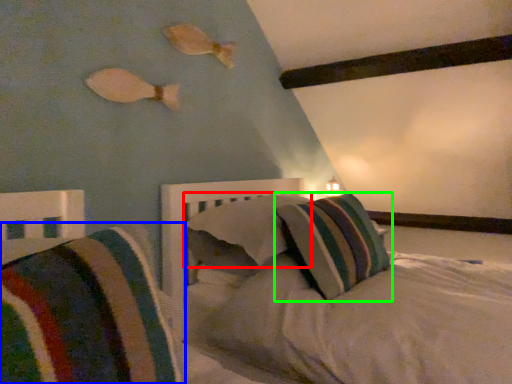
Question: Which object is positioned closest to pillow (highlighted by a red box)? Select from pillow (highlighted by a blue box) and pillow (highlighted by a green box).

Choices:
 (A) pillow
 (B) pillow

Answer: (B)